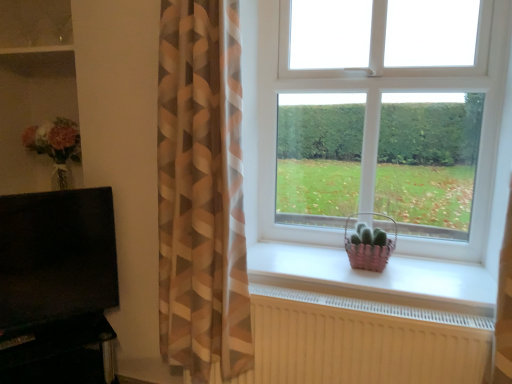
Question: Does white plastic window at center contain brown/white striped curtain at left?

Choices:
 (A) no
 (B) yes

Answer: (A)

Question: Can you confirm if white plastic window at center is wider than brown/white striped curtain at left?

Choices:
 (A) yes
 (B) no

Answer: (B)

Question: From a real-world perspective, is white plastic window at center over brown/white striped curtain at left?

Choices:
 (A) yes
 (B) no

Answer: (A)

Question: Does white plastic window at center appear on the right side of brown/white striped curtain at left?

Choices:
 (A) yes
 (B) no

Answer: (A)

Question: Does white plastic window at center have a smaller size compared to brown/white striped curtain at left?

Choices:
 (A) no
 (B) yes

Answer: (B)

Question: Considering the relative sizes of white plastic window at center and brown/white striped curtain at left in the image provided, is white plastic window at center bigger than brown/white striped curtain at left?

Choices:
 (A) yes
 (B) no

Answer: (B)

Question: From a real-world perspective, is pink woven basket at window under matte glass shelf at upper left?

Choices:
 (A) yes
 (B) no

Answer: (A)

Question: Is pink woven basket at window oriented away from matte glass shelf at upper left?

Choices:
 (A) yes
 (B) no

Answer: (B)

Question: Is pink woven basket at window shorter than matte glass shelf at upper left?

Choices:
 (A) yes
 (B) no

Answer: (B)

Question: Is pink woven basket at window wider than matte glass shelf at upper left?

Choices:
 (A) yes
 (B) no

Answer: (B)

Question: Does pink woven basket at window appear on the left side of matte glass shelf at upper left?

Choices:
 (A) yes
 (B) no

Answer: (B)

Question: Is pink woven basket at window facing towards matte glass shelf at upper left?

Choices:
 (A) yes
 (B) no

Answer: (B)

Question: Is pink woven basket at window positioned before brown/white striped curtain at left?

Choices:
 (A) no
 (B) yes

Answer: (A)